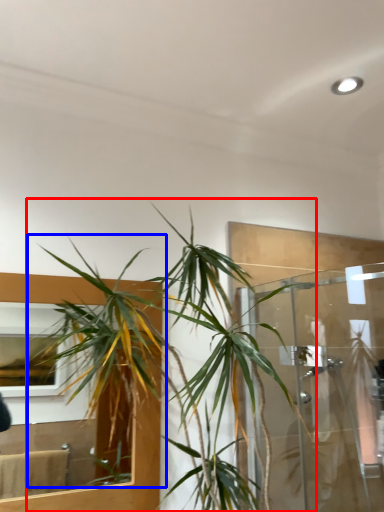
Question: Among these objects, which one is farthest to the camera, houseplant (highlighted by a red box) or vegetation (highlighted by a blue box)?

Choices:
 (A) houseplant
 (B) vegetation

Answer: (B)